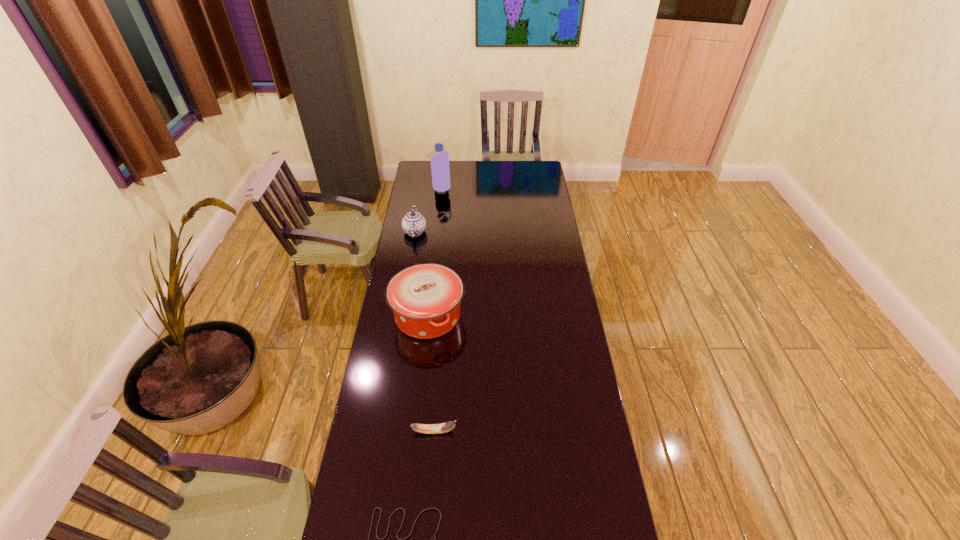
Locate an element on the screen. The width and height of the screenshot is (960, 540). empty location between the farthest object and the fourth shortest object is located at coordinates (434, 252).

Image resolution: width=960 pixels, height=540 pixels. I want to click on vacant area that lies between the casserole and the second nearest object, so click(x=431, y=373).

Locate an element on the screen. Image resolution: width=960 pixels, height=540 pixels. vacant region between the second nearest object and the third nearest object is located at coordinates (431, 373).

The width and height of the screenshot is (960, 540). What are the coordinates of `vacant area that lies between the shampoo and the fourth nearest object` in the screenshot? It's located at (427, 210).

Where is `object that is the second closest to the shampoo`? This screenshot has height=540, width=960. object that is the second closest to the shampoo is located at coordinates (425, 298).

Where is `the closest object to the banana`? The image size is (960, 540). the closest object to the banana is located at coordinates (431, 539).

The height and width of the screenshot is (540, 960). I want to click on vacant space that satisfies the following two spatial constraints: 1. at the spout of the fourth nearest object; 2. on the back side of the second tallest object, so click(x=400, y=315).

This screenshot has width=960, height=540. What are the coordinates of `vacant space that satisfies the following two spatial constraints: 1. at the spout of the fourth nearest object; 2. on the left side of the second tallest object` in the screenshot? It's located at (400, 315).